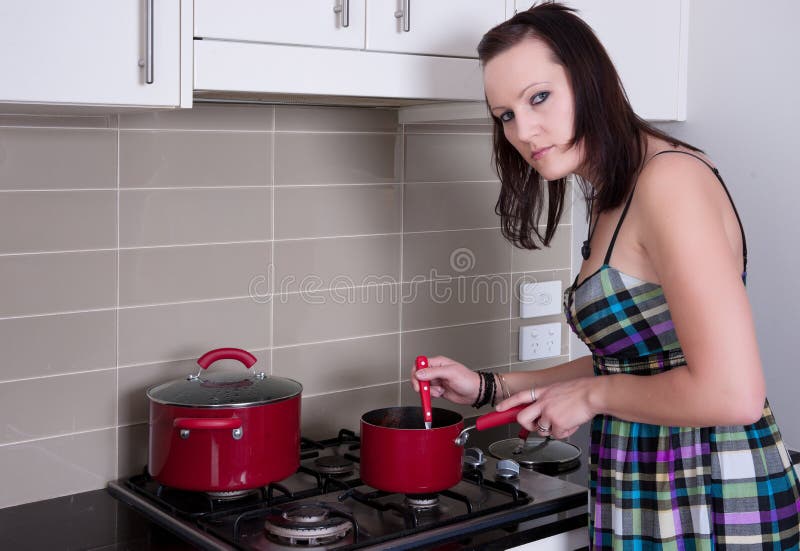
Where is `utensil`? The height and width of the screenshot is (551, 800). utensil is located at coordinates (422, 386).